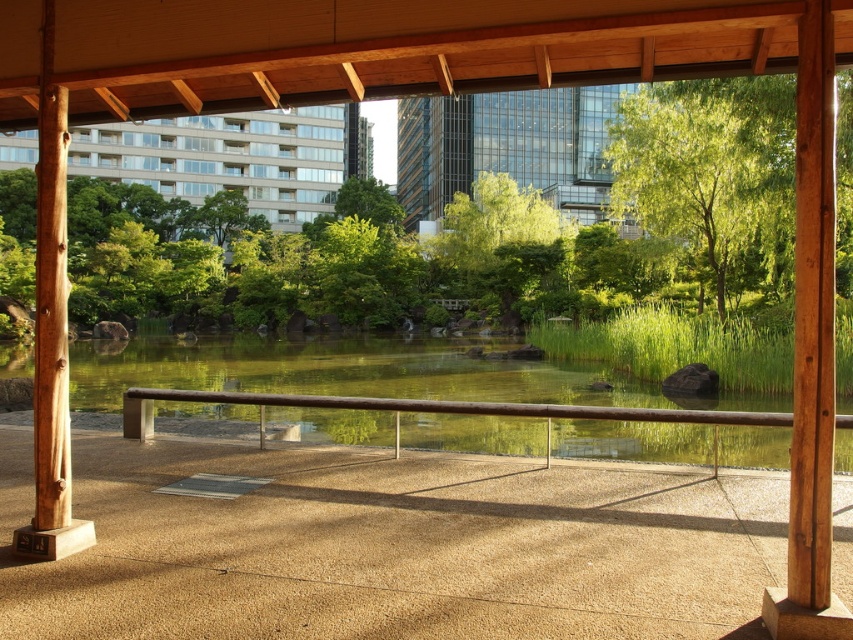
You are standing on the polished concrete floor of the wooden pavilion and want to know which object is taller between the green leafy tree at upper right and the brown wood rail at center. Can you determine this based on your observation?

The green leafy tree at upper right has a greater height compared to the brown wood rail at center, so the green leafy tree at upper right is taller.

You are standing on the polished concrete floor of the wooden pavilion and want to walk towards the brown wood rail at center. As you move forward, will the green leafy tree at upper right become more visible or less visible in your view?

The green leafy tree at upper right is further to the viewer than the brown wood rail at center. As you move toward the brown wood rail at center, the green leafy tree at upper right will become less visible in your view because it is behind the rail.